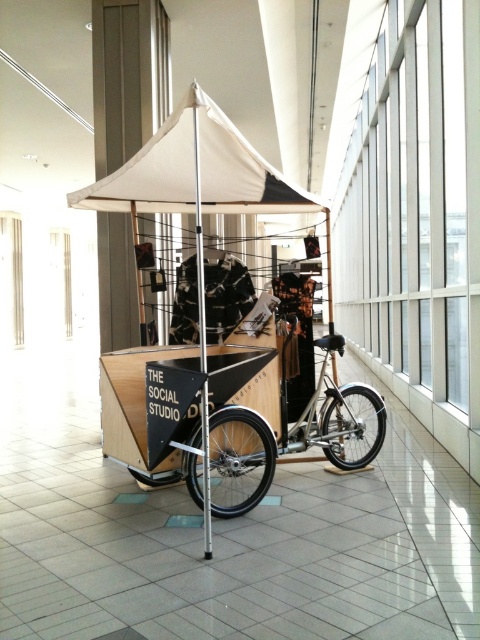
Is white canvas canopy at center thinner than silver metallic bicycle at center?

No, white canvas canopy at center is not thinner than silver metallic bicycle at center.

What do you see at coordinates (194, 172) in the screenshot?
I see `white canvas canopy at center` at bounding box center [194, 172].

This screenshot has width=480, height=640. I want to click on white canvas canopy at center, so click(x=194, y=172).